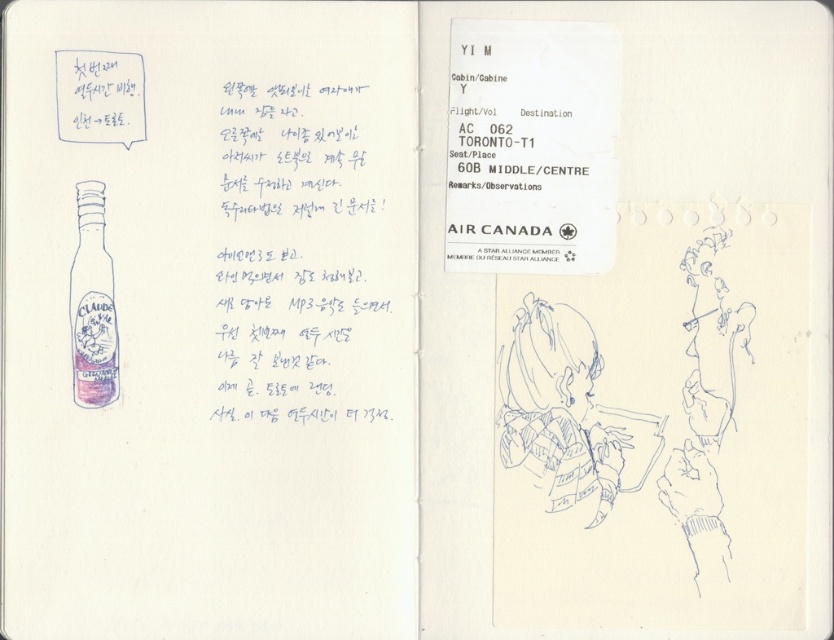
Question: Is black paper at center smaller than matte glass bottle at left?

Choices:
 (A) no
 (B) yes

Answer: (A)

Question: Does black paper at center appear under matte glass bottle at left?

Choices:
 (A) no
 (B) yes

Answer: (A)

Question: Does black paper at center appear over matte glass bottle at left?

Choices:
 (A) no
 (B) yes

Answer: (B)